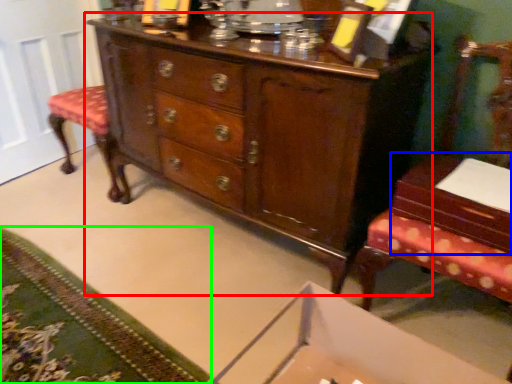
Question: Based on their relative distances, which object is nearer to chest of drawers (highlighted by a red box)? Choose from table (highlighted by a blue box) and mat (highlighted by a green box).

Choices:
 (A) table
 (B) mat

Answer: (A)